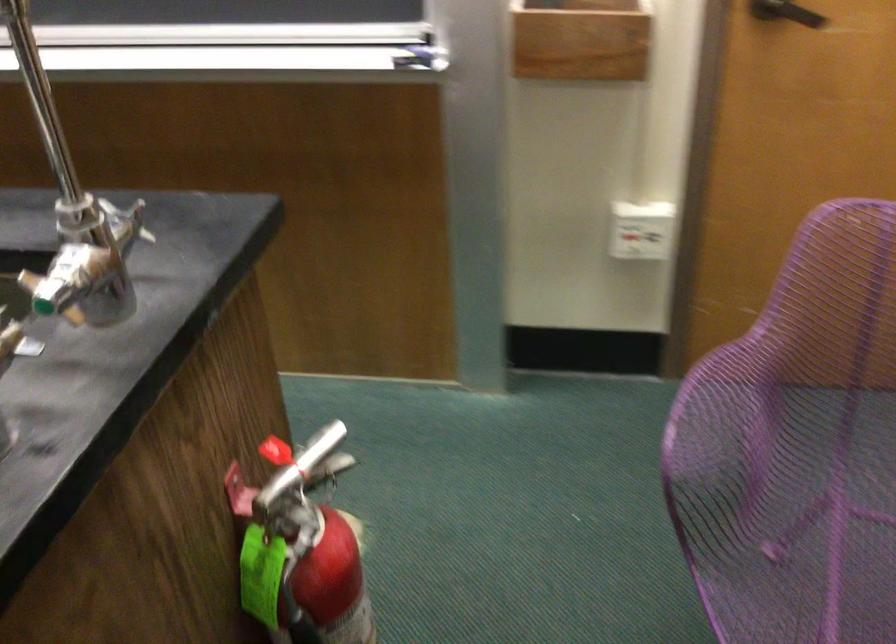
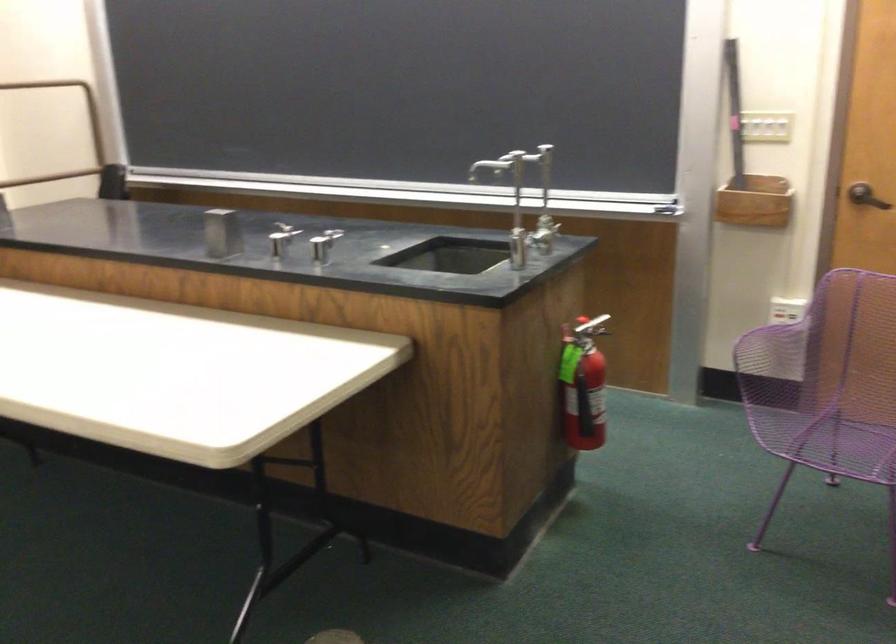
Find the pixel in the second image that matches point 306,469 in the first image.

(590, 327)